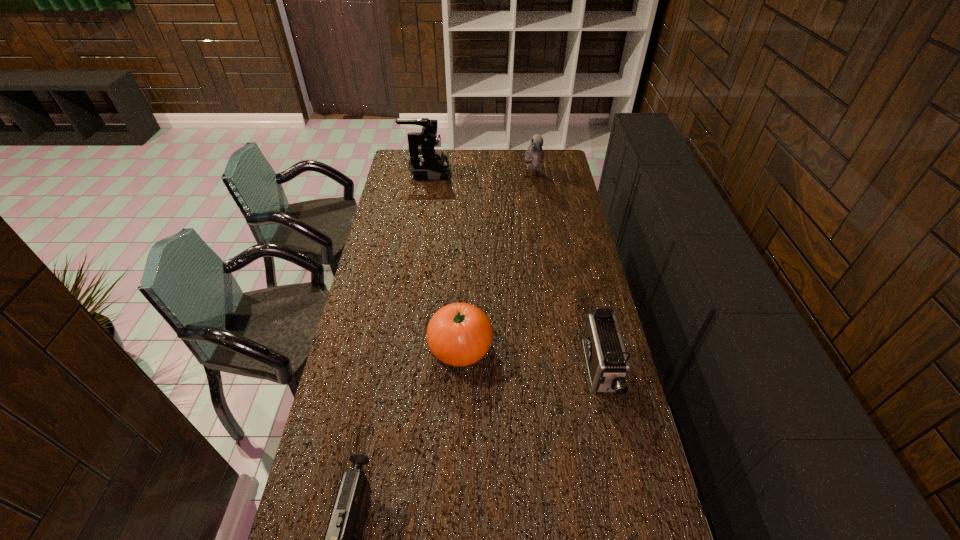
Locate an element on the screen. parrot that is positioned at the far edge is located at coordinates (534, 155).

Find the location of a particular element. object that is at the left edge is located at coordinates (427, 161).

Where is `parrot positioned at the right edge`? parrot positioned at the right edge is located at coordinates click(534, 155).

Identify the location of camcorder positioned at the right edge. Image resolution: width=960 pixels, height=540 pixels. (607, 361).

Where is `object at the far left corner`? object at the far left corner is located at coordinates (427, 161).

The width and height of the screenshot is (960, 540). What are the coordinates of `object located at the far right corner` in the screenshot? It's located at pyautogui.click(x=534, y=155).

I want to click on free space at the far edge, so click(x=499, y=170).

Where is `vacant region at the left edge of the desktop`? The image size is (960, 540). vacant region at the left edge of the desktop is located at coordinates (348, 336).

The image size is (960, 540). What are the coordinates of `free spot at the right edge of the desktop` in the screenshot? It's located at (540, 192).

The height and width of the screenshot is (540, 960). I want to click on free area in between the rightmost camcorder and the tallest camcorder, so click(514, 272).